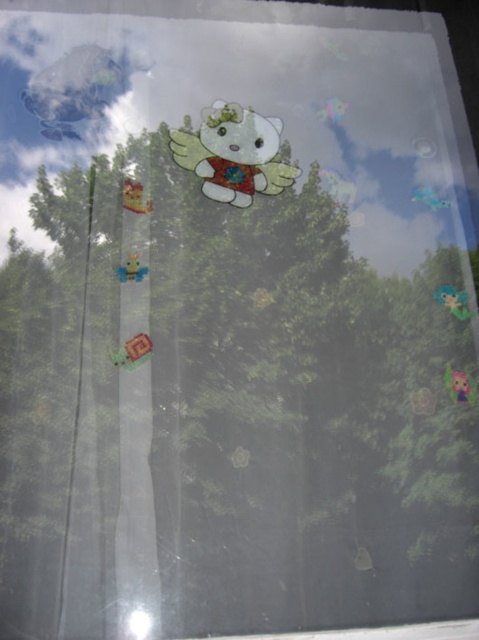
Question: Which object is the farthest from the matte yellow plush at center?

Choices:
 (A) blue fabric flower at lower right
 (B) shiny metallic robot at upper left

Answer: (A)

Question: Is shiny metallic robot at upper left to the left of blue fabric flower at lower right from the viewer's perspective?

Choices:
 (A) yes
 (B) no

Answer: (A)

Question: Considering the relative positions of shiny metallic robot at upper left and matte yellow plush at center in the image provided, where is shiny metallic robot at upper left located with respect to matte yellow plush at center?

Choices:
 (A) right
 (B) left

Answer: (B)

Question: Among these objects, which one is nearest to the camera?

Choices:
 (A) matte plastic hello kitty at center
 (B) shiny pink toy at bottom right

Answer: (B)

Question: Is matte plastic hello kitty at center thinner than shiny metallic robot at upper left?

Choices:
 (A) yes
 (B) no

Answer: (B)

Question: Which object is closer to the camera taking this photo?

Choices:
 (A) blue fabric flower at lower right
 (B) shiny pink toy at bottom right
 (C) matte yellow plush at center
 (D) matte plastic hello kitty at center

Answer: (B)